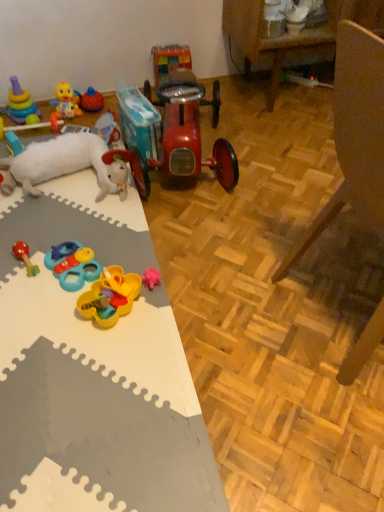
At what (x,y) coordinates should I click in order to perform the action: click on unoccupied region to the right of white foam mat at left. Please return your answer as a coordinate pair (x, y). This screenshot has height=512, width=384. Looking at the image, I should click on (262, 267).